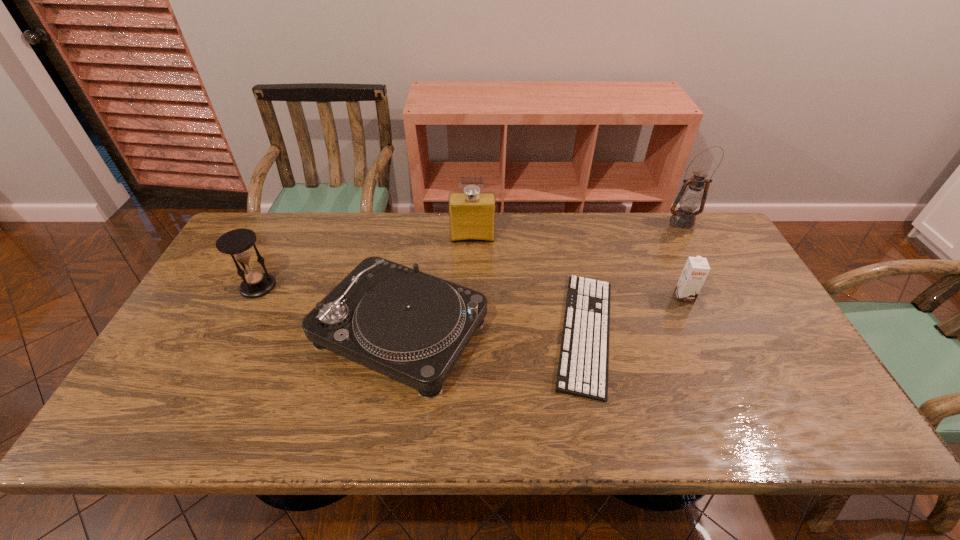
Identify the location of object that is at the far right corner. (690, 198).

Identify the location of vacant space at the far edge. Image resolution: width=960 pixels, height=540 pixels. (577, 238).

This screenshot has width=960, height=540. I want to click on vacant region at the near edge of the desktop, so click(252, 442).

Locate an element on the screen. free location at the left edge is located at coordinates (183, 324).

Image resolution: width=960 pixels, height=540 pixels. In the image, there is a desktop. What are the coordinates of `free space at the right edge` in the screenshot? It's located at (x=795, y=363).

This screenshot has height=540, width=960. In order to click on vacant space at the far right corner in this screenshot , I will do `click(667, 214)`.

Where is `free space between the tallest object and the second tallest object`? This screenshot has width=960, height=540. free space between the tallest object and the second tallest object is located at coordinates (578, 230).

The height and width of the screenshot is (540, 960). What are the coordinates of `vacant area that lies between the computer keyboard and the record player` in the screenshot? It's located at (493, 332).

Find the location of a particular element. Image resolution: width=960 pixels, height=540 pixels. vacant area between the third object from right to left and the tallest object is located at coordinates (634, 278).

You are a GUI agent. You are given a task and a screenshot of the screen. Output one action in this format:
    pyautogui.click(x=<x>, y=<y>)
    Task: Click on the free space that is in between the rightmost object and the perfume
    This screenshot has height=540, width=960.
    Given the screenshot: What is the action you would take?
    pyautogui.click(x=578, y=230)